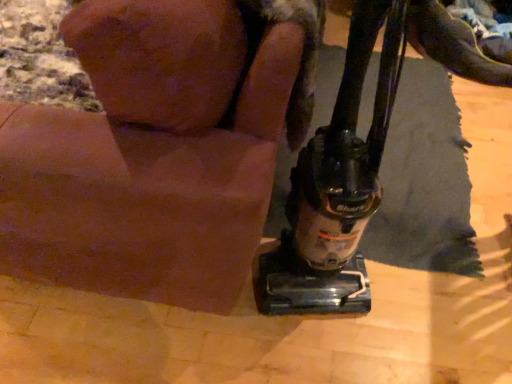
Question: Is furry brown dog at lower right aimed at black leather shoe at upper right?

Choices:
 (A) no
 (B) yes

Answer: (A)

Question: Are furry brown dog at lower right and black leather shoe at upper right making contact?

Choices:
 (A) no
 (B) yes

Answer: (A)

Question: Does furry brown dog at lower right come behind black leather shoe at upper right?

Choices:
 (A) yes
 (B) no

Answer: (B)

Question: Considering the relative sizes of furry brown dog at lower right and black leather shoe at upper right in the image provided, is furry brown dog at lower right taller than black leather shoe at upper right?

Choices:
 (A) no
 (B) yes

Answer: (B)

Question: From a real-world perspective, is furry brown dog at lower right on black leather shoe at upper right?

Choices:
 (A) yes
 (B) no

Answer: (A)

Question: From the image's perspective, is furry brown dog at lower right above black leather shoe at upper right?

Choices:
 (A) yes
 (B) no

Answer: (B)

Question: Does black leather shoe at upper right have a smaller size compared to black plastic vacuum cleaner at lower right?

Choices:
 (A) no
 (B) yes

Answer: (B)

Question: Considering the relative positions of black leather shoe at upper right and black plastic vacuum cleaner at lower right in the image provided, is black leather shoe at upper right to the right of black plastic vacuum cleaner at lower right from the viewer's perspective?

Choices:
 (A) no
 (B) yes

Answer: (B)

Question: From a real-world perspective, does black leather shoe at upper right stand above black plastic vacuum cleaner at lower right?

Choices:
 (A) no
 (B) yes

Answer: (A)

Question: Is black leather shoe at upper right not near black plastic vacuum cleaner at lower right?

Choices:
 (A) yes
 (B) no

Answer: (A)

Question: Can you confirm if black leather shoe at upper right is taller than black plastic vacuum cleaner at lower right?

Choices:
 (A) yes
 (B) no

Answer: (B)

Question: From the image's perspective, is black leather shoe at upper right on black plastic vacuum cleaner at lower right?

Choices:
 (A) yes
 (B) no

Answer: (A)

Question: Considering the relative sizes of black plastic vacuum cleaner at lower right and black leather shoe at upper right in the image provided, is black plastic vacuum cleaner at lower right wider than black leather shoe at upper right?

Choices:
 (A) no
 (B) yes

Answer: (A)